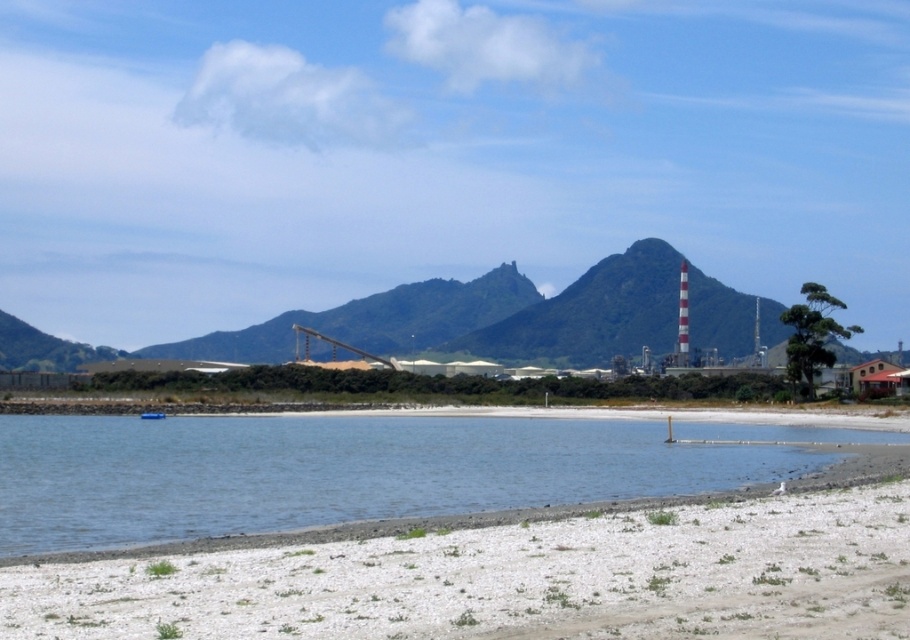
Question: Which point is farther to the camera?

Choices:
 (A) white gravelly sand at lower center
 (B) blue plastic boat at lower left
 (C) blue water at lower left

Answer: (B)

Question: Which object is closer to the camera taking this photo?

Choices:
 (A) blue water at lower left
 (B) white gravelly sand at lower center

Answer: (B)

Question: Is blue water at lower left to the left of blue plastic boat at lower left from the viewer's perspective?

Choices:
 (A) no
 (B) yes

Answer: (A)

Question: Can you confirm if white gravelly sand at lower center is smaller than blue plastic boat at lower left?

Choices:
 (A) no
 (B) yes

Answer: (A)

Question: Observing the image, what is the correct spatial positioning of blue water at lower left in reference to blue plastic boat at lower left?

Choices:
 (A) right
 (B) left

Answer: (A)

Question: Which object is farther from the camera taking this photo?

Choices:
 (A) blue water at lower left
 (B) white gravelly sand at lower center

Answer: (A)